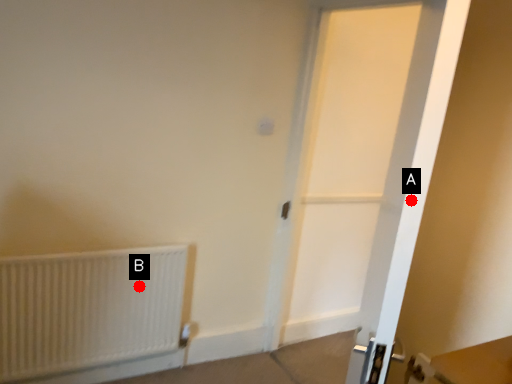
Question: Two points are circled on the image, labeled by A and B beside each circle. Which point is farther from the camera taking this photo?

Choices:
 (A) A is further
 (B) B is further

Answer: (B)